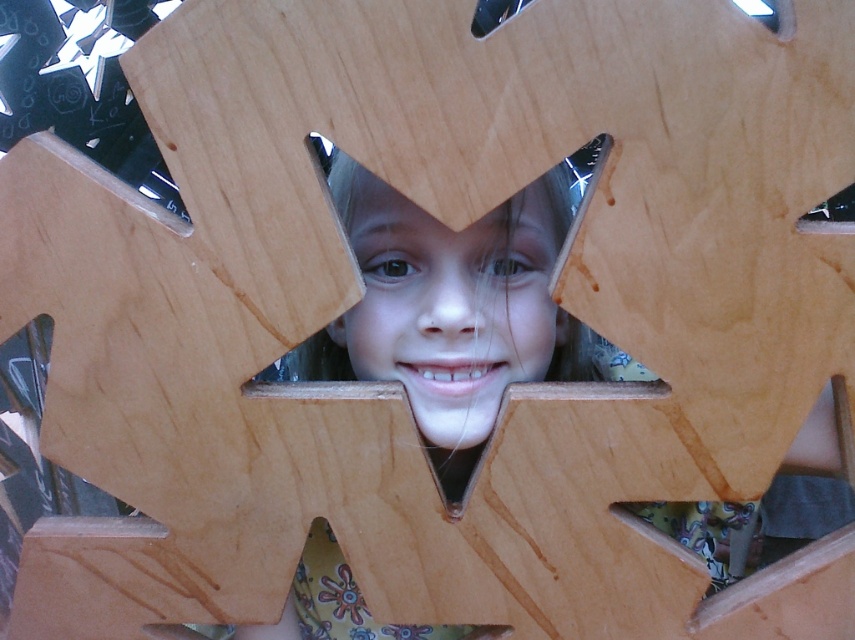
Question: Is matte wood face at center below clear plastic triangle at center?

Choices:
 (A) yes
 (B) no

Answer: (A)

Question: Which of the following is the farthest from the observer?

Choices:
 (A) transparent plastic hole at upper right
 (B) clear plastic triangle at center

Answer: (B)

Question: Which object appears farthest from the camera in this image?

Choices:
 (A) transparent plastic hole at upper right
 (B) metallic silver at upper center
 (C) clear plastic triangle at center
 (D) matte wood face at center

Answer: (C)

Question: Estimate the real-world distances between objects in this image. Which object is closer to the clear plastic triangle at center?

Choices:
 (A) transparent plastic hole at upper right
 (B) matte wood face at center

Answer: (A)

Question: Does matte wood face at center have a smaller size compared to metallic silver at upper center?

Choices:
 (A) no
 (B) yes

Answer: (A)

Question: Is the position of matte wood face at center more distant than that of transparent plastic hole at upper right?

Choices:
 (A) yes
 (B) no

Answer: (A)